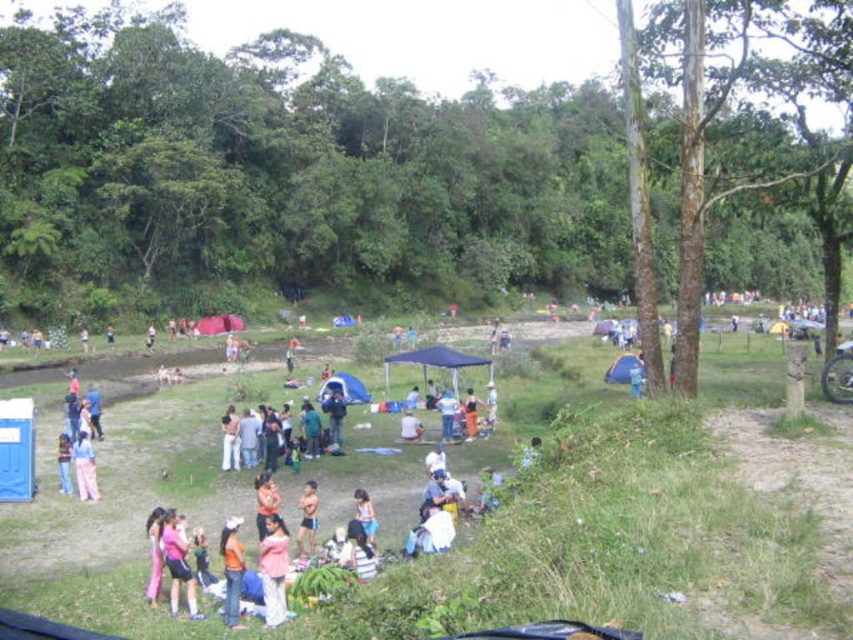
You are a photographer setting up a camera at the lower left corner of the clearing. You notice two items of clothing, the pink fabric dress at lower left and the pink fabric pants at lower left. The camera has a 10 feet focal range. Can you capture both items in a single photo without moving the camera?

The pink fabric dress at lower left is 19.63 feet away from the pink fabric pants at lower left. Since the camera has a 10 feet focal range, the distance between them exceeds the focal range, so you cannot capture both items in a single photo without moving the camera.

You are standing at the point marked as point (177,563) in the image. What is the nearest object to you?

The nearest object to you is the pink fabric dress at lower left, as the point (177,563) is on it.

You are a photographer at the gathering and want to capture a photo that includes both the orange fabric shirt at lower center and the pink fabric at center. Which fabric should you focus on first to ensure both are in the frame?

The orange fabric shirt at lower center is positioned under the pink fabric at center, so focusing on the pink fabric at center first will ensure both are visible in the frame.